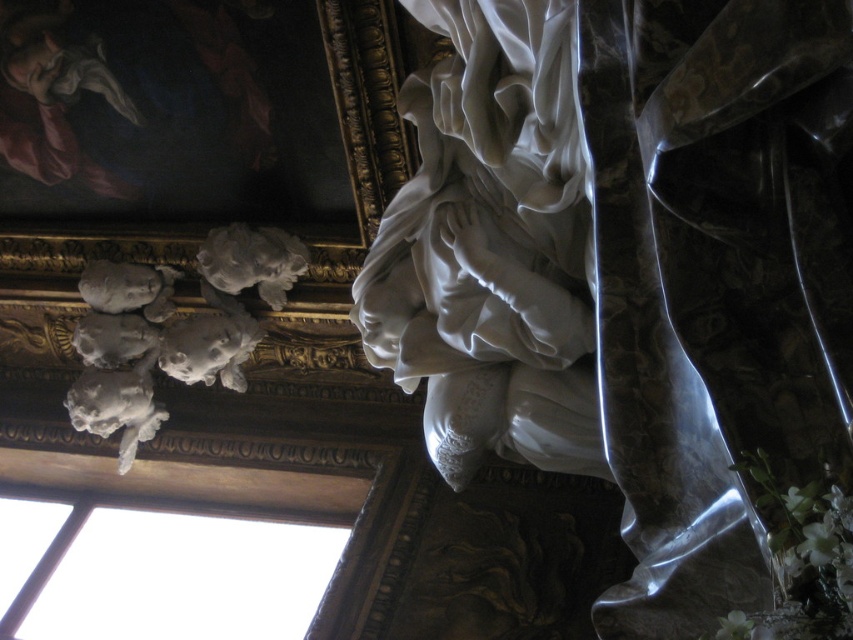
You are an art conservator examining the upper left corner of the scene. You need to assess both the transparent glass window at upper left and the white marble cherubs at upper left. Which object is located to the right of the other?

The transparent glass window at upper left is positioned on the right side of white marble cherubs at upper left, so the transparent glass window at upper left is to the right of the white marble cherubs at upper left.

You are an art conservator examining the interior. You need to assess the lighting conditions for both the transparent glass window at upper left and the white marble cherubs at upper left. Which object allows more natural light into the space?

The transparent glass window at upper left is larger in size than the white marble cherubs at upper left, so it allows more natural light into the space.